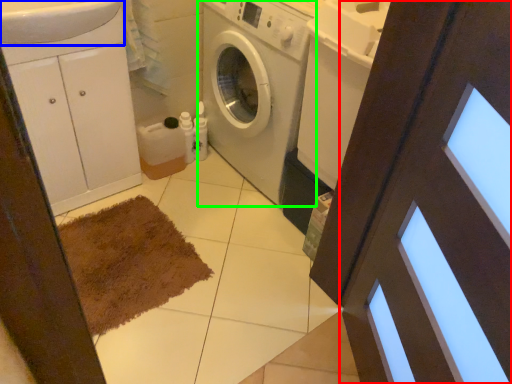
Question: Which object is positioned closest to screen door (highlighted by a red box)? Select from sink (highlighted by a blue box) and washing machine (highlighted by a green box).

Choices:
 (A) sink
 (B) washing machine

Answer: (B)